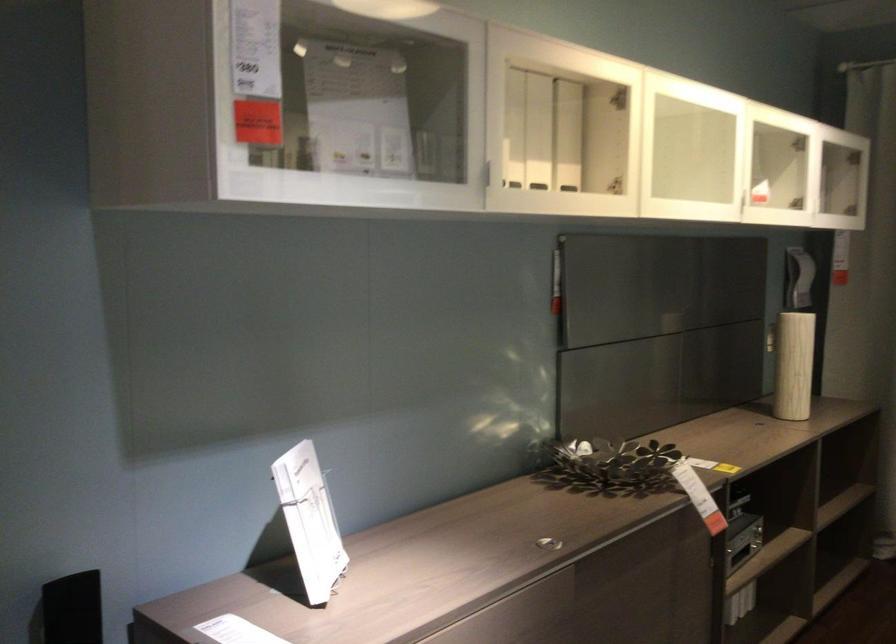
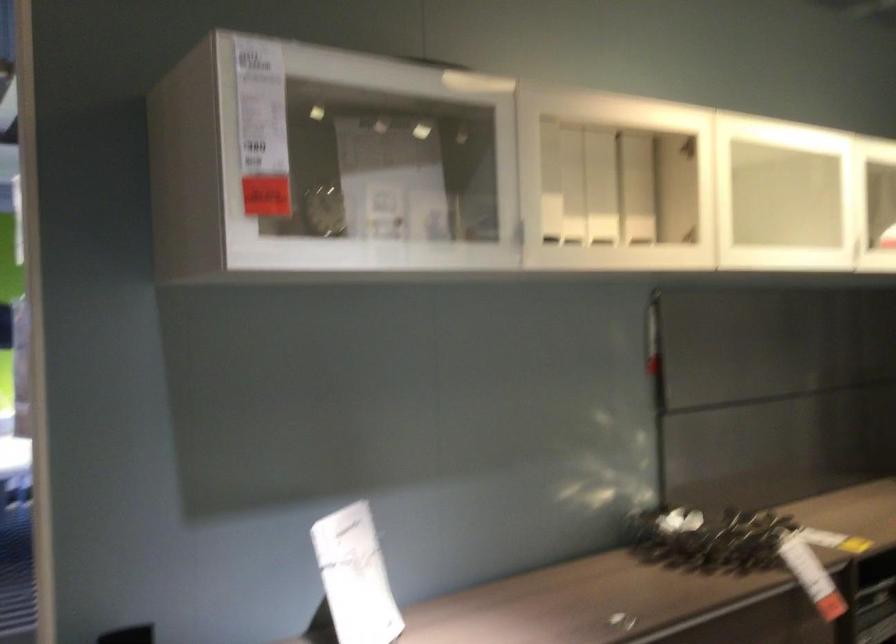
In the second image, find the point that corresponds to (569,136) in the first image.

(636, 187)